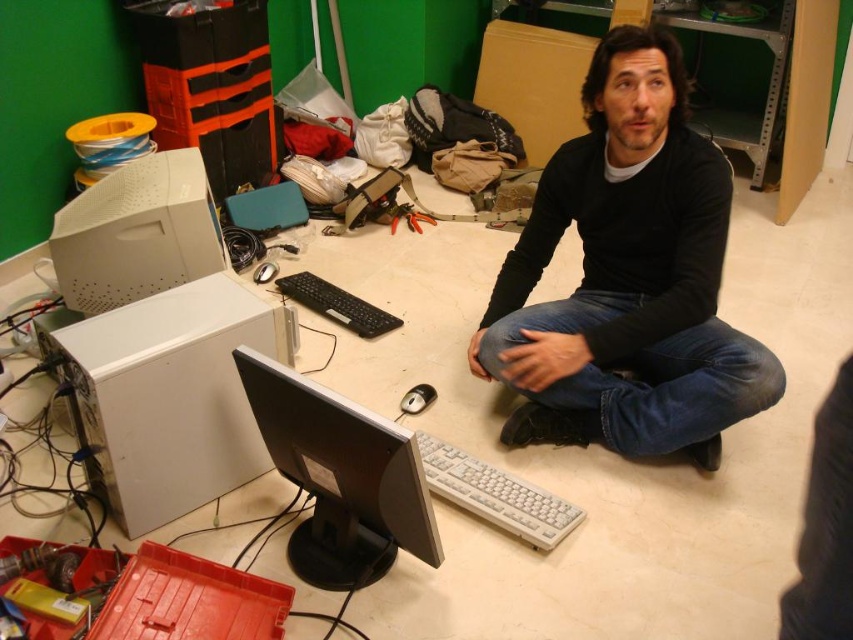
You are organizing a photo shoot for a tech product catalog and need to ensure that the black matte shirt at center and the white plastic computer case at lower left are both visible in the frame. Given their sizes, which object might require more careful positioning to avoid being overshadowed?

The white plastic computer case at lower left requires more careful positioning because it is smaller than the black matte shirt at center.